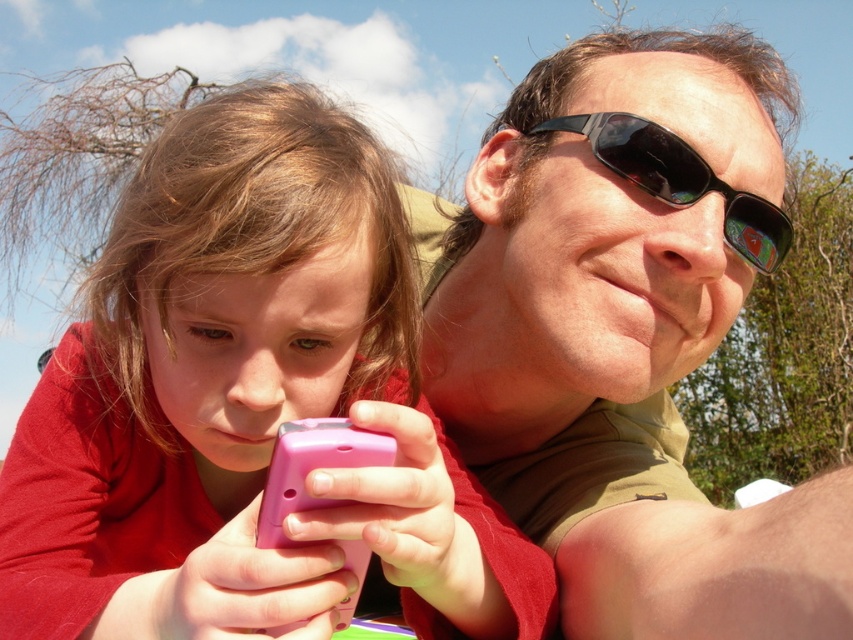
Question: Among these objects, which one is nearest to the camera?

Choices:
 (A) matte black sunglasses at upper center
 (B) pink matte phone at center
 (C) black plastic sunglasses at upper center

Answer: (A)

Question: Does pink matte phone at center have a lesser width compared to matte black sunglasses at upper center?

Choices:
 (A) yes
 (B) no

Answer: (A)

Question: Which of the following is the closest to the observer?

Choices:
 (A) black plastic sunglasses at upper center
 (B) matte black sunglasses at upper center
 (C) pink matte phone at center

Answer: (B)

Question: Which point is closer to the camera taking this photo?

Choices:
 (A) (36, 488)
 (B) (786, 252)
 (C) (598, 392)

Answer: (A)

Question: Can you confirm if matte black sunglasses at upper center is thinner than black plastic sunglasses at upper center?

Choices:
 (A) yes
 (B) no

Answer: (B)

Question: Does pink matte phone at center appear on the right side of black plastic sunglasses at upper center?

Choices:
 (A) yes
 (B) no

Answer: (B)